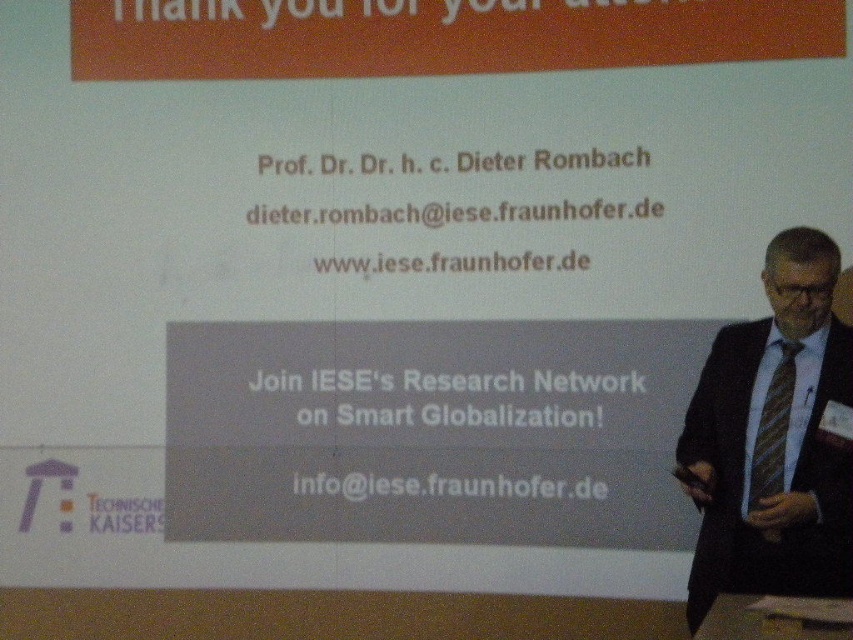
The height and width of the screenshot is (640, 853). Describe the element at coordinates (773, 440) in the screenshot. I see `black suit at right` at that location.

Who is more distant from viewer, (795, 282) or (753, 458)?

The point (753, 458) is behind.

Locate an element on the screen. black suit at right is located at coordinates (773, 440).